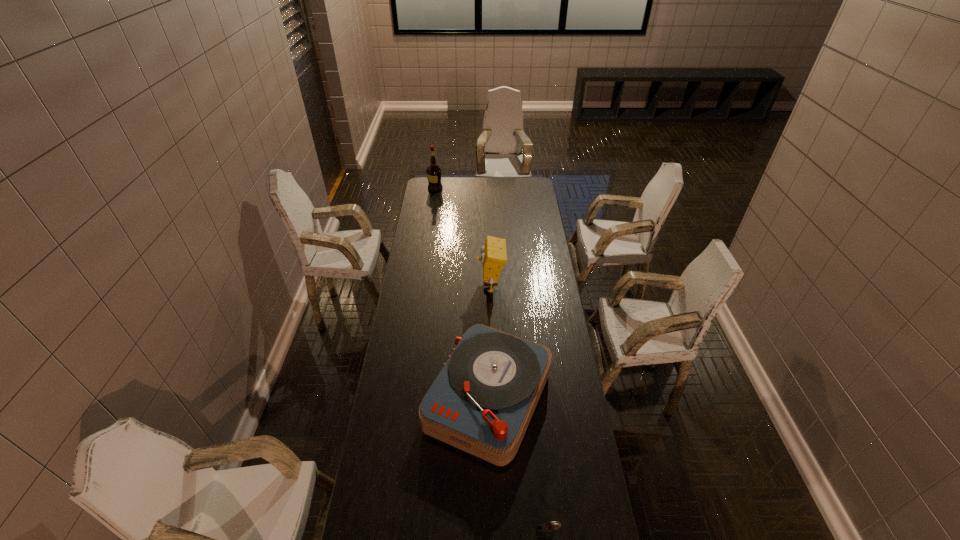
Where is `free space located 0.170m on the face of the second tallest object`? Image resolution: width=960 pixels, height=540 pixels. free space located 0.170m on the face of the second tallest object is located at coordinates (442, 286).

Locate an element on the screen. vacant space located 0.150m on the face of the second tallest object is located at coordinates (445, 286).

In order to click on blank area located on the back of the second nearest object in this screenshot , I will do `click(487, 283)`.

What are the coordinates of `object present at the far edge` in the screenshot? It's located at (433, 172).

Locate an element on the screen. The height and width of the screenshot is (540, 960). object that is at the left edge is located at coordinates 433,172.

What are the coordinates of `record player situated at the right edge` in the screenshot? It's located at (482, 401).

Locate an element on the screen. This screenshot has width=960, height=540. padlock that is at the right edge is located at coordinates (544, 530).

Identify the location of object that is positioned at the far left corner. The height and width of the screenshot is (540, 960). (433, 172).

At what (x,y) coordinates should I click in order to perform the action: click on vacant area at the far edge. Please return your answer as a coordinate pair (x, y). This screenshot has width=960, height=540. Looking at the image, I should click on (449, 177).

I want to click on free space at the left edge, so click(414, 431).